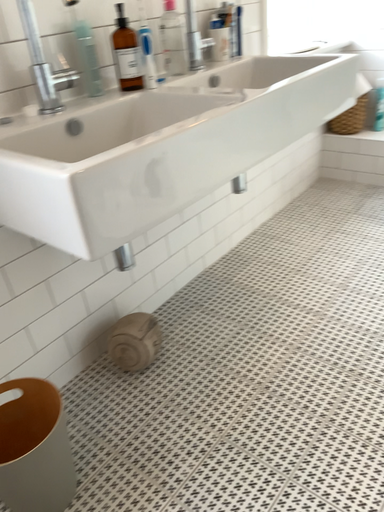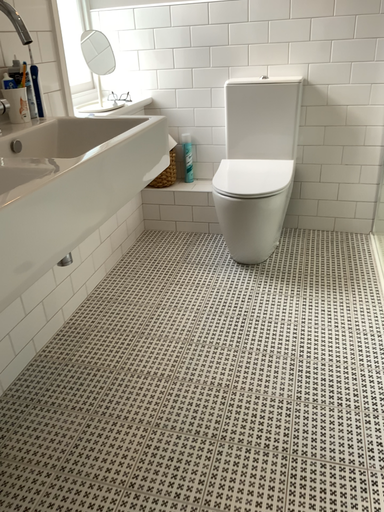
Question: How did the camera likely rotate when shooting the video?

Choices:
 (A) rotated downward
 (B) rotated upward

Answer: (B)